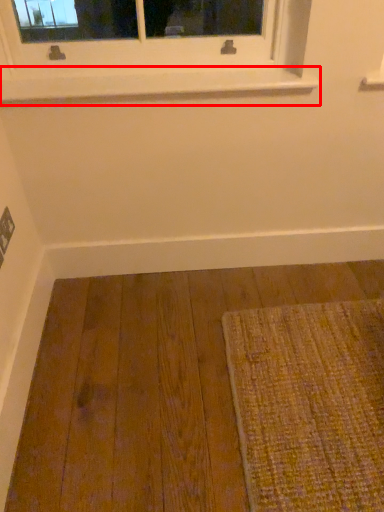
Question: From the image, what is the correct spatial relationship of window sill (annotated by the red box) in relation to molding?

Choices:
 (A) left
 (B) right

Answer: (A)